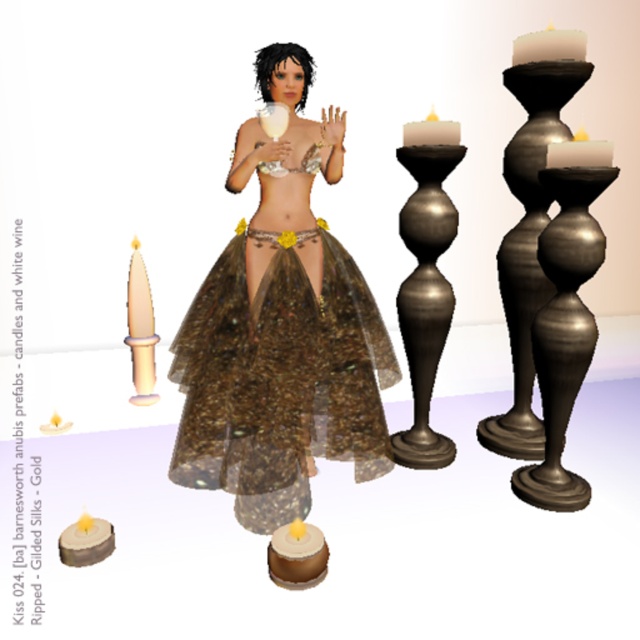
You are a guest at a party and standing in front of the brown matte cake at lower center. The host asks you to retrieve a knife placed exactly 8 feet away from you. Can you reach the knife from your current position?

The brown matte cake at lower center is 8.08 feet away from the viewer, so the knife placed exactly 8 feet away is slightly closer than the cake. You can reach the knife by moving towards it from your current position.

You are a fashion designer who wants to create a new outfit inspired by the character in the image. The ripped gilded silks at center and the polished bronze candlestick at right are part of the design elements. Which element should you prioritize in terms of size to maintain the visual balance of the outfit?

The ripped gilded silks at center should be prioritized as the larger element since it is already larger than the polished bronze candlestick at right, helping to maintain visual balance by emphasizing its central position.

You are a fashion designer observing the character in the image. You need to decide whether the ripped gilded silks at center can be placed next to the polished bronze candlestick at right without overlapping. Based on their sizes, what would you recommend?

The ripped gilded silks at center might be wider than polished bronze candlestick at right, so there could be a risk of overlapping if placed side by side. To avoid overlap, ensure sufficient spacing between them.